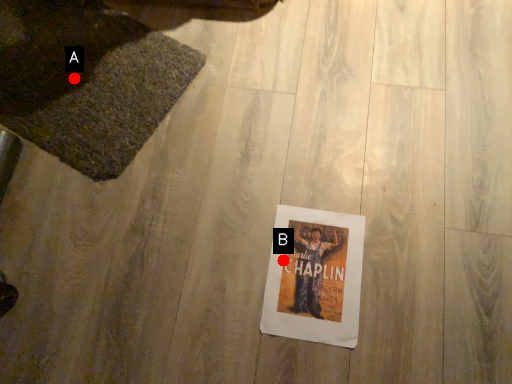
Question: Two points are circled on the image, labeled by A and B beside each circle. Which point appears farthest from the camera in this image?

Choices:
 (A) A is further
 (B) B is further

Answer: (A)